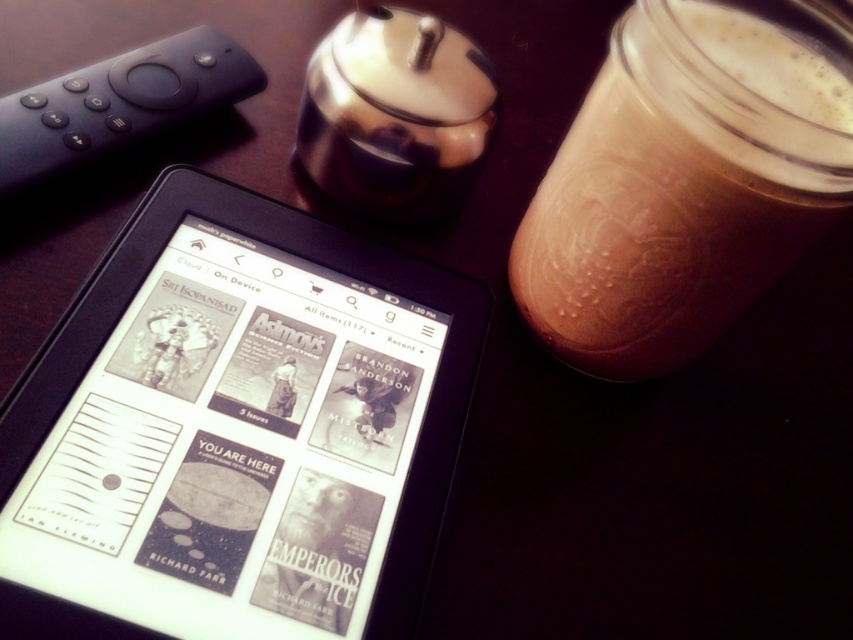
Question: Can you confirm if black e-reader at center is positioned to the right of brown matte glass jar at upper right?

Choices:
 (A) yes
 (B) no

Answer: (B)

Question: Can you confirm if black e-reader at center is positioned above brown matte glass jar at upper right?

Choices:
 (A) no
 (B) yes

Answer: (A)

Question: Is black e-reader at center above brown matte glass jar at upper right?

Choices:
 (A) yes
 (B) no

Answer: (B)

Question: Which point is farther to the camera?

Choices:
 (A) black e-reader at center
 (B) brown matte glass jar at upper right

Answer: (B)

Question: Which point appears farthest from the camera in this image?

Choices:
 (A) (646, 104)
 (B) (79, 493)

Answer: (A)

Question: Among these objects, which one is farthest from the camera?

Choices:
 (A) brown matte glass jar at upper right
 (B) black e-reader at center

Answer: (A)